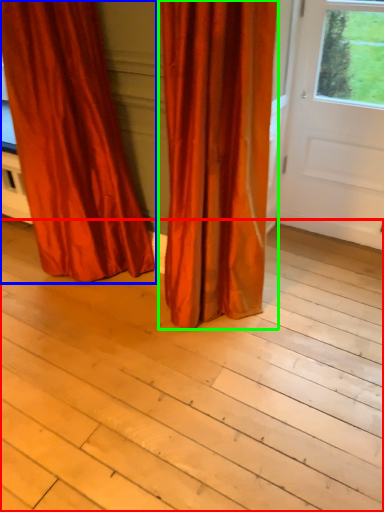
Question: Which is nearer to the plank (highlighted by a red box)? curtain (highlighted by a blue box) or curtain (highlighted by a green box).

Choices:
 (A) curtain
 (B) curtain

Answer: (B)